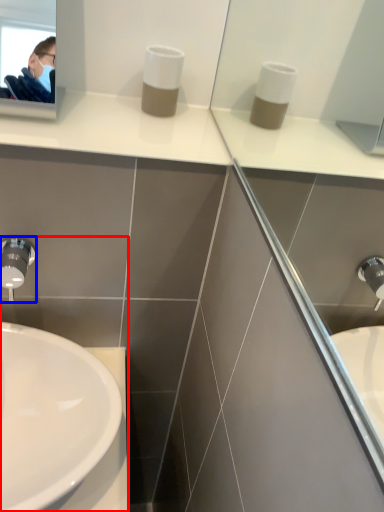
Question: Which of the following is the closest to the observer, sink (highlighted by a red box) or tap (highlighted by a blue box)?

Choices:
 (A) sink
 (B) tap

Answer: (A)